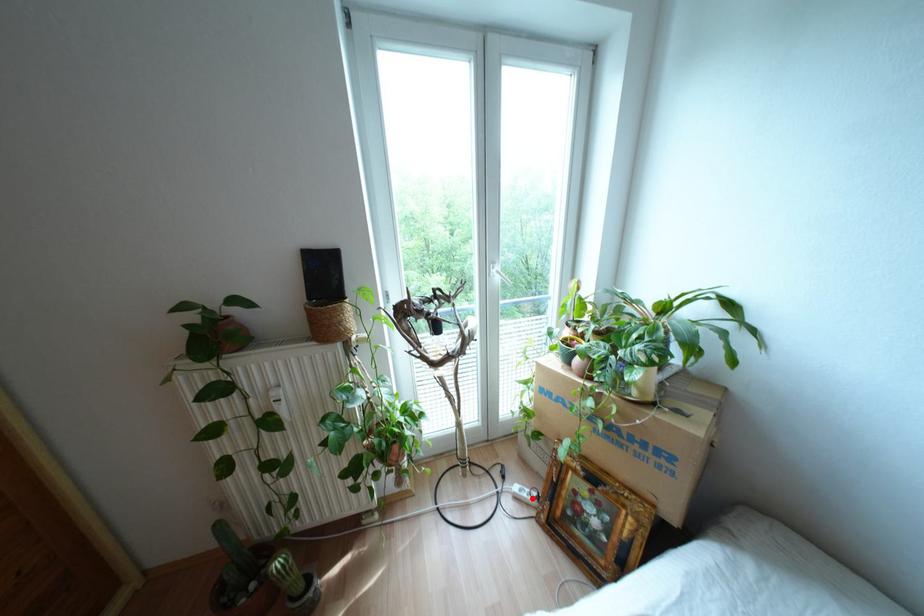
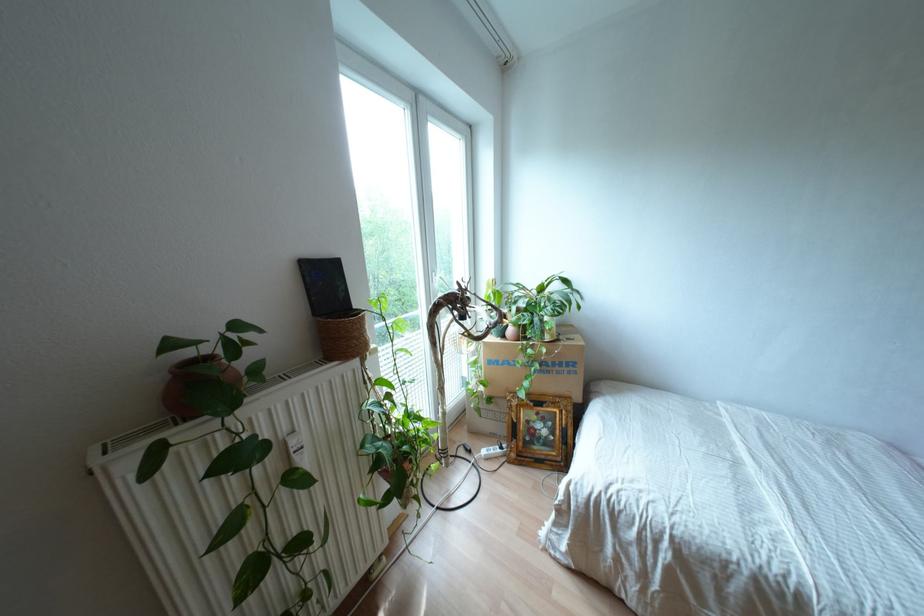
Question: A red point is marked in image1. In image2, is the corresponding 3D point closer to the camera or farther? Reply with the corresponding letter.

Choices:
 (A) The corresponding 3D point is closer.
 (B) The corresponding 3D point is farther.

Answer: (B)